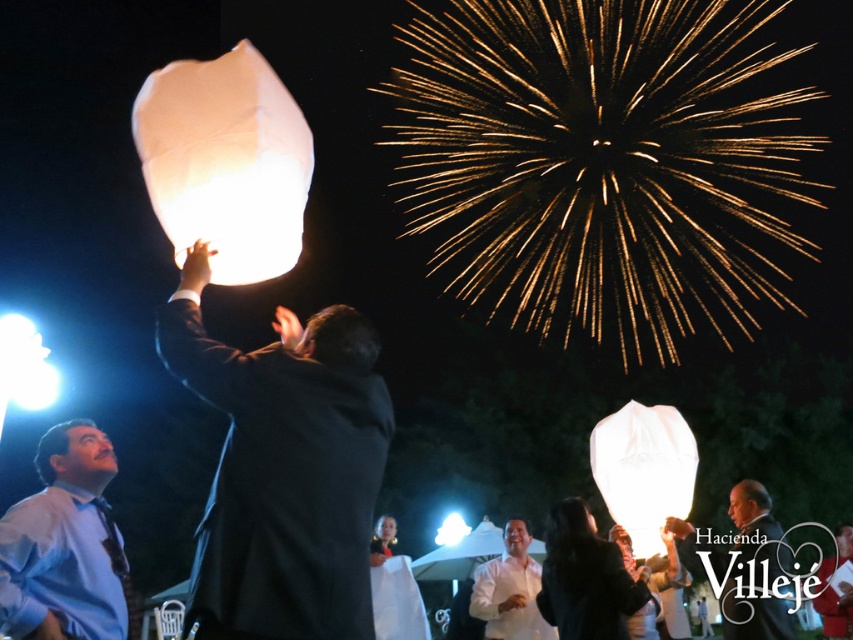
You are at the event and want to take a photo of both the white translucent paper lantern at upper center and the white paper lantern at upper center. Which one will appear larger in your photo?

The white translucent paper lantern at upper center will appear larger in your photo because it is closer to the viewer than the white paper lantern at upper center.

You are organizing a photo shoot and need to position the matte black suit at center and the matte blue shirt at lower left in a way that they don not block each other. Based on the scene description, which object is wider and should be placed first to avoid overlap?

The matte black suit at center might be wider than the matte blue shirt at lower left, so it should be placed first to avoid overlap.

You are attending the event and want to take a photo of both the matte blue shirt at lower left and the white translucent paper lantern at upper center in the same frame. Considering their sizes, which object should you zoom in on to ensure both are visible?

The matte blue shirt at lower left is smaller in width than the white translucent paper lantern at upper center. To include both in the frame, you should zoom out slightly to accommodate their size difference.